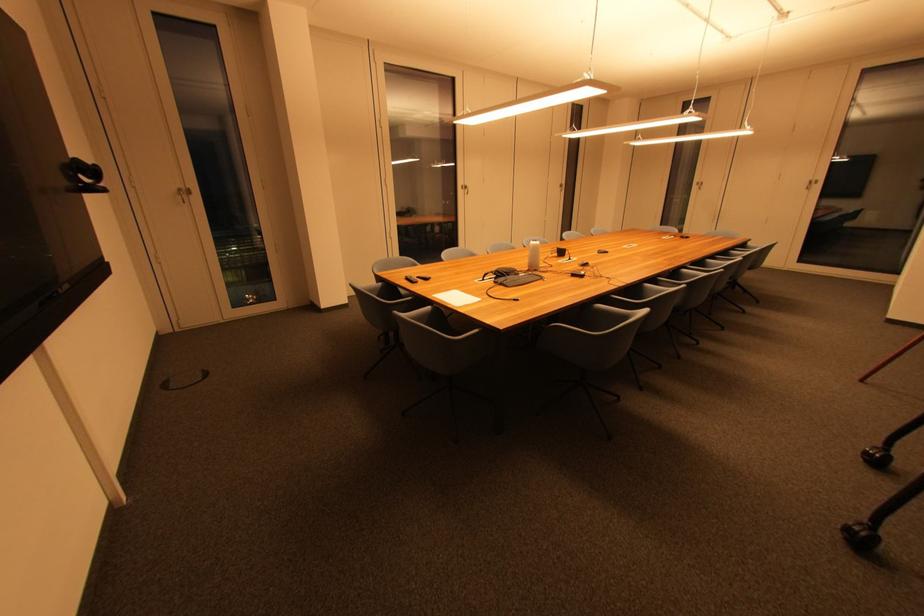
This screenshot has height=616, width=924. What are the coordinates of `white water bottle` in the screenshot? It's located at (533, 254).